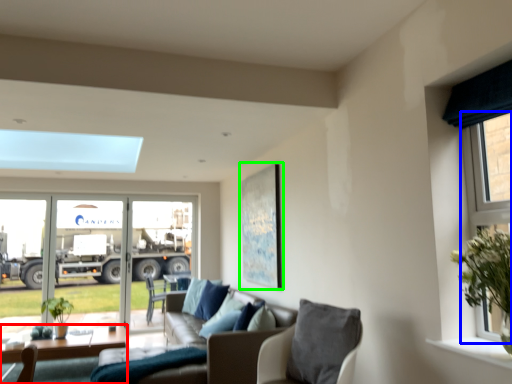
Question: Which object is the farthest from table (highlighted by a red box)? Choose among these: window (highlighted by a blue box) or picture frame (highlighted by a green box).

Choices:
 (A) window
 (B) picture frame

Answer: (A)